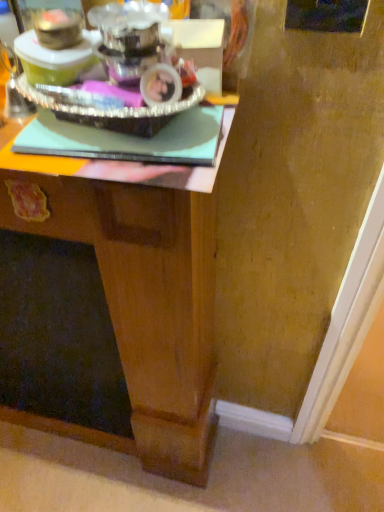
Find the location of a particular element. This screenshot has height=512, width=384. vacant space underneath wooden desk at center (from a real-world perspective) is located at coordinates (88, 452).